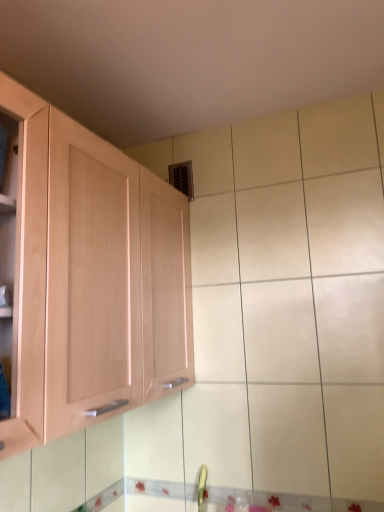
You are a GUI agent. You are given a task and a screenshot of the screen. Output one action in this format:
    pyautogui.click(x=<x>, y=<y>)
    Task: Click on the light wood cabinet at left
    
    Given the screenshot: What is the action you would take?
    pyautogui.click(x=91, y=279)

What is the approximate width of light wood cabinet at left?

It is 34.63 centimeters.

Image resolution: width=384 pixels, height=512 pixels. What do you see at coordinates (91, 279) in the screenshot?
I see `light wood cabinet at left` at bounding box center [91, 279].

Measure the distance between point [155,182] and camera.

The distance of point [155,182] from camera is 1.44 meters.

Image resolution: width=384 pixels, height=512 pixels. What are the coordinates of `light wood cabinet at left` in the screenshot? It's located at (91, 279).